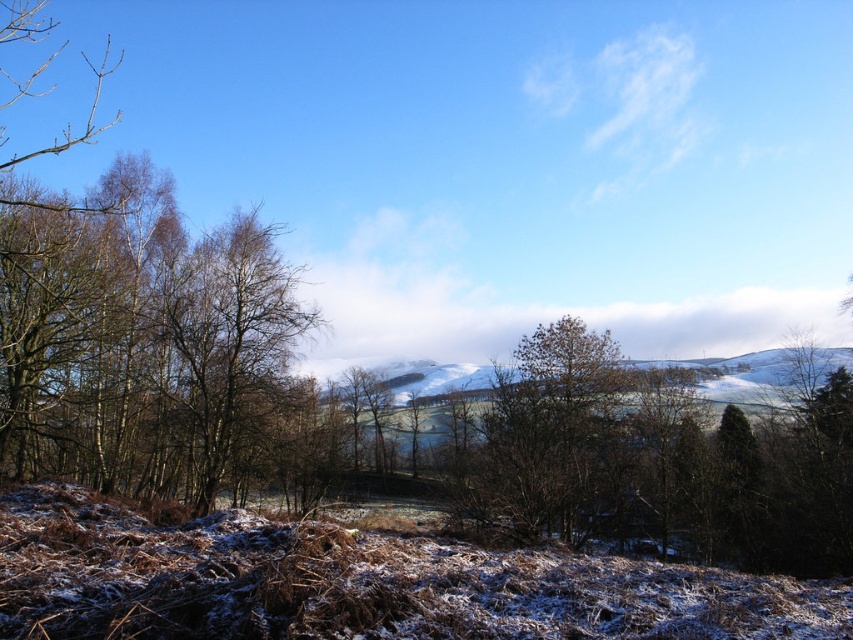
You are an artist planning to paint the winter landscape. You want to ensure the brown bark tree at left and the brown textured tree at center are proportionally accurate. Which tree should you draw wider in your painting?

The brown bark tree at left should be drawn wider since its width is larger than the brown textured tree at center.

You are standing in the winter landscape and notice two points marked on the ground. The first point is at coordinates point (184, 492) and the second is at point (514, 492). Which point is closer to your current position?

Point (184, 492) is further to the camera than point (514, 492), so the closer point to your current position is point (514, 492).

You are an observer standing in the winter landscape. You notice the brown bark tree at left and the brown textured tree at center. Which tree appears closer to you?

The brown bark tree at left appears closer because it is positioned over the brown textured tree at center, indicating it is in front.